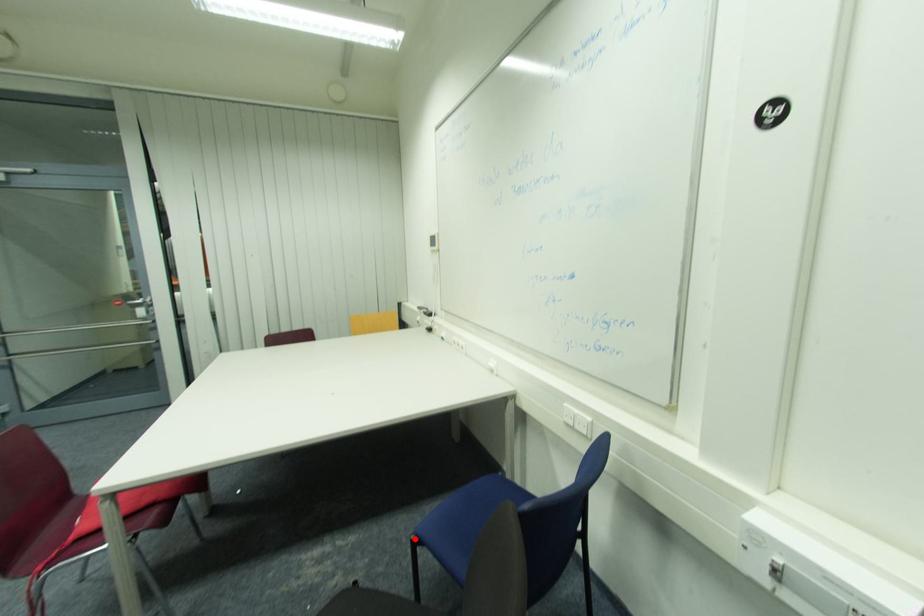
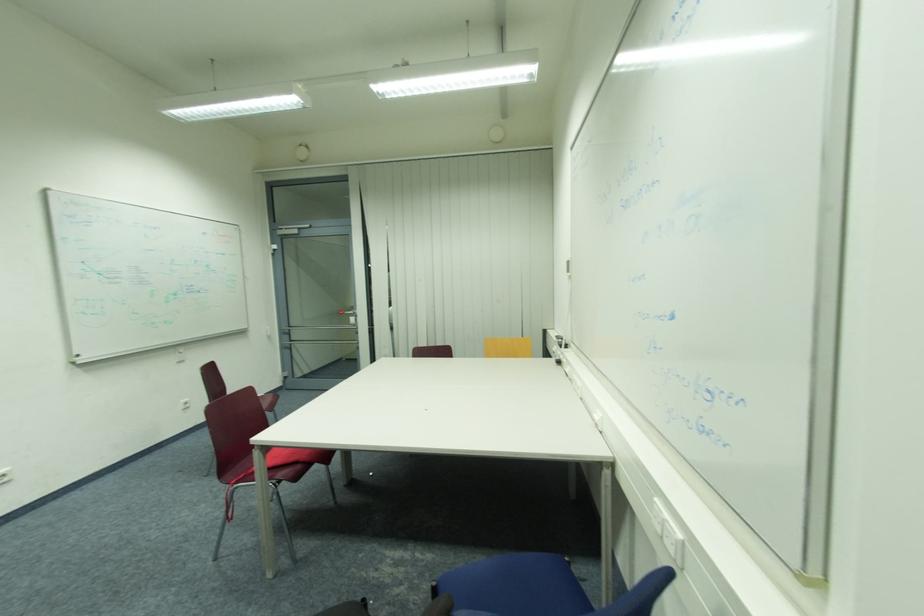
Question: I am providing you with two images of the same scene from different viewpoints. Image1 has a red point marked. In image2, the corresponding 3D location appears at what relative position? Reply with the corresponding letter.

Choices:
 (A) Closer
 (B) Farther

Answer: (A)